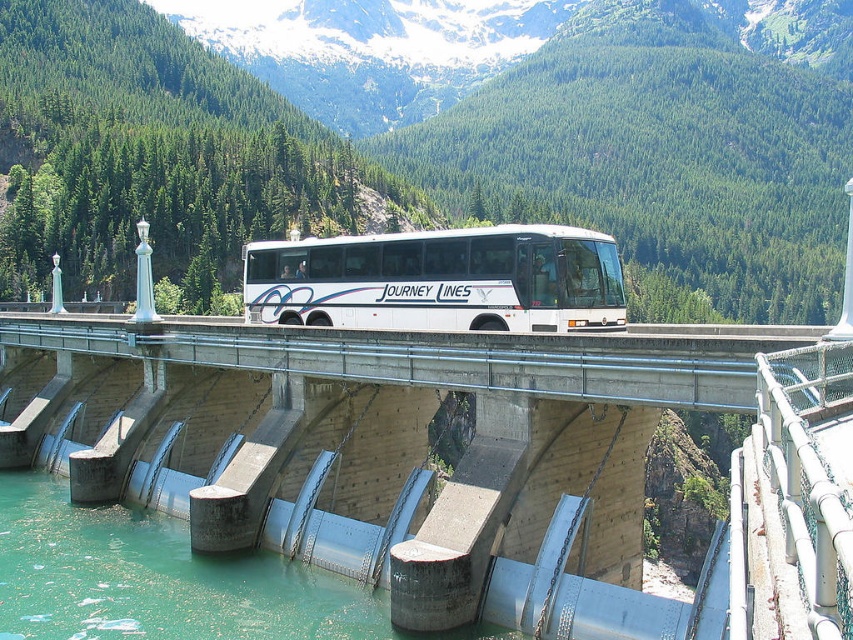
Question: Is the position of concrete bridge at center less distant than that of green forested mountain at upper center?

Choices:
 (A) no
 (B) yes

Answer: (B)

Question: Does green concrete water at lower left have a larger size compared to white matte bus at center?

Choices:
 (A) yes
 (B) no

Answer: (B)

Question: Which object appears farthest from the camera in this image?

Choices:
 (A) green forested mountain at upper center
 (B) concrete bridge at center

Answer: (A)

Question: Is concrete bridge at center closer to the viewer compared to green forested mountain at upper center?

Choices:
 (A) no
 (B) yes

Answer: (B)

Question: Estimate the real-world distances between objects in this image. Which object is farther from the green concrete water at lower left?

Choices:
 (A) green forested mountain at upper center
 (B) concrete bridge at center
 (C) white matte bus at center

Answer: (A)

Question: Which object is farther from the camera taking this photo?

Choices:
 (A) green concrete water at lower left
 (B) white matte bus at center
 (C) concrete bridge at center

Answer: (B)